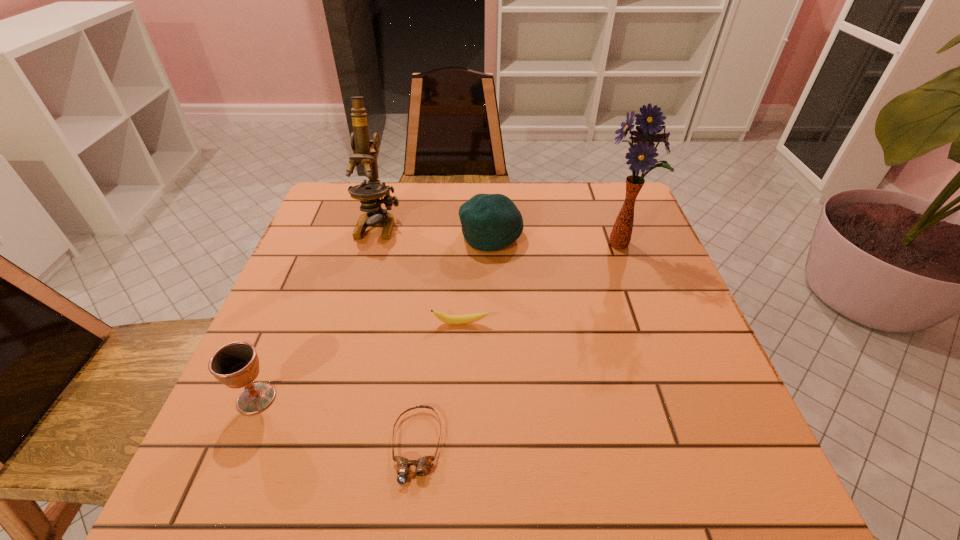
Locate an element on the screen. The image size is (960, 540). object that is at the far right corner is located at coordinates (641, 155).

Where is `free region at the far edge of the desktop`? Image resolution: width=960 pixels, height=540 pixels. free region at the far edge of the desktop is located at coordinates (446, 189).

The width and height of the screenshot is (960, 540). I want to click on free space at the near edge of the desktop, so click(x=561, y=482).

Where is `vacant area at the left edge`? vacant area at the left edge is located at coordinates (333, 307).

I want to click on free space at the right edge of the desktop, so click(681, 307).

Where is `blank space at the far left corner of the desktop`? blank space at the far left corner of the desktop is located at coordinates (320, 222).

In the image, there is a desktop. Identify the location of vacant space at the near left corner. (254, 495).

I want to click on vacant area at the far right corner of the desktop, so click(610, 192).

Identify the location of unoccupied area between the shortest object and the leftmost object. Image resolution: width=960 pixels, height=540 pixels. (336, 422).

The height and width of the screenshot is (540, 960). What are the coordinates of `empty space that is in between the flower arrangement and the shortest object` in the screenshot? It's located at (518, 346).